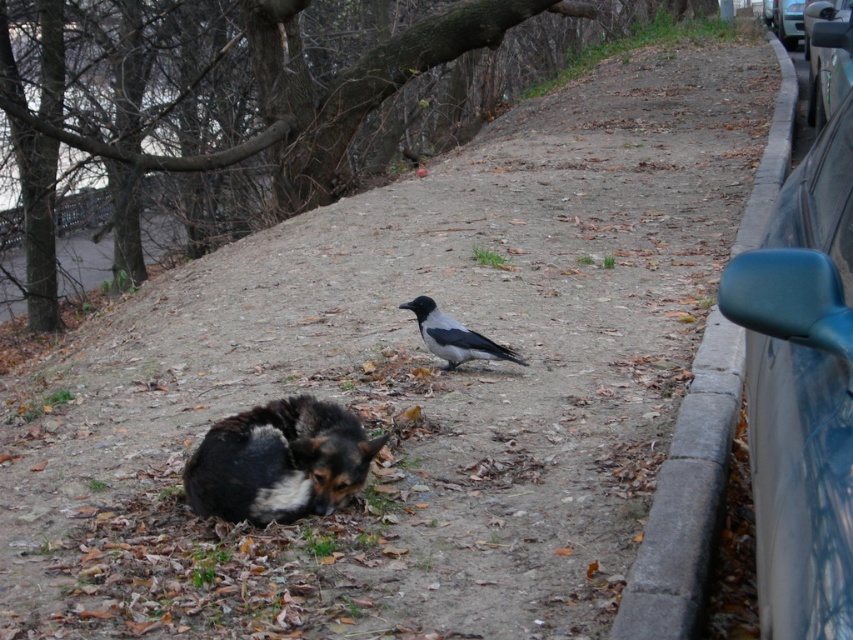
You are a delivery robot that needs to navigate around the black fur dog at lower left and the gray concrete curb at right. Which object is larger in size?

The gray concrete curb at right is bigger than the black fur dog at lower left.

You are standing in the autumn scene and want to pick up two points marked in the image. Which point is closer to you, point (x=825, y=120) or point (x=802, y=19)?

Point (x=825, y=120) is closer to the viewer than point (x=802, y=19).